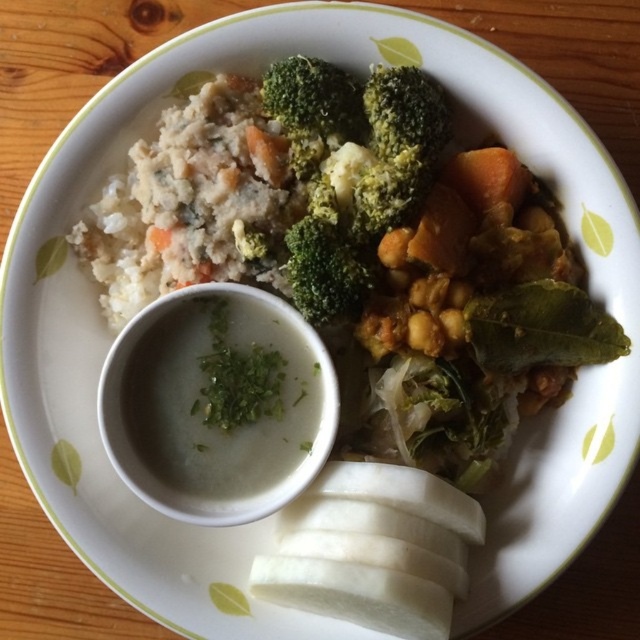
Does point (124, 304) come closer to viewer compared to point (276, 476)?

No, (124, 304) is behind (276, 476).

Identify the location of white fluffy rice at upper left. Image resolution: width=640 pixels, height=640 pixels. (192, 202).

Identify the location of white fluffy rice at upper left. (192, 202).

Find the location of a particular element. white fluffy rice at upper left is located at coordinates (192, 202).

Is white creamy soup at center taller than green matte broccoli at center?

No, white creamy soup at center is not taller than green matte broccoli at center.

Find the location of a particular element. The width and height of the screenshot is (640, 640). white creamy soup at center is located at coordinates (221, 397).

Find the location of a particular element. The height and width of the screenshot is (640, 640). white creamy soup at center is located at coordinates (221, 397).

Does white fluffy rice at upper left lie behind green matte broccoli at center?

That is True.

In order to click on white fluffy rice at upper left in this screenshot , I will do `click(192, 202)`.